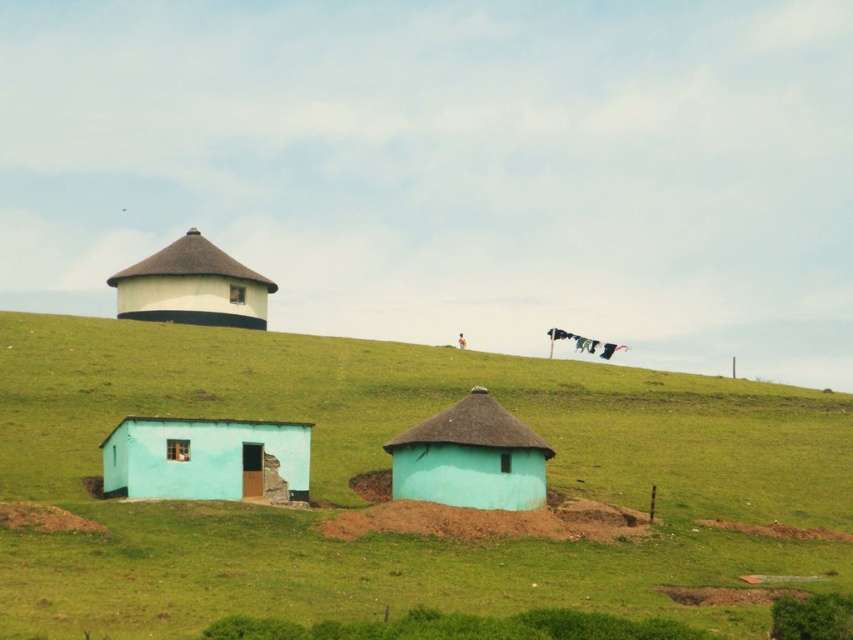
Question: Is green grassy at lower center closer to the viewer compared to white thatched roof hut at upper center?

Choices:
 (A) yes
 (B) no

Answer: (A)

Question: Which of the following is the closest to the observer?

Choices:
 (A) green grassy at lower center
 (B) light blue clay hut at lower left
 (C) white thatched roof hut at upper center
 (D) matte teal thatched hut at center

Answer: (A)

Question: Which of these objects is positioned farthest from the green grassy at lower center?

Choices:
 (A) light blue clay hut at lower left
 (B) white thatched roof hut at upper center
 (C) matte teal thatched hut at center

Answer: (B)

Question: Which point is farther to the camera?

Choices:
 (A) green grassy at lower center
 (B) matte teal thatched hut at center

Answer: (B)

Question: Is light blue clay hut at lower left to the left of matte teal thatched hut at center from the viewer's perspective?

Choices:
 (A) yes
 (B) no

Answer: (A)

Question: Is green grassy at lower center wider than light blue clay hut at lower left?

Choices:
 (A) yes
 (B) no

Answer: (A)